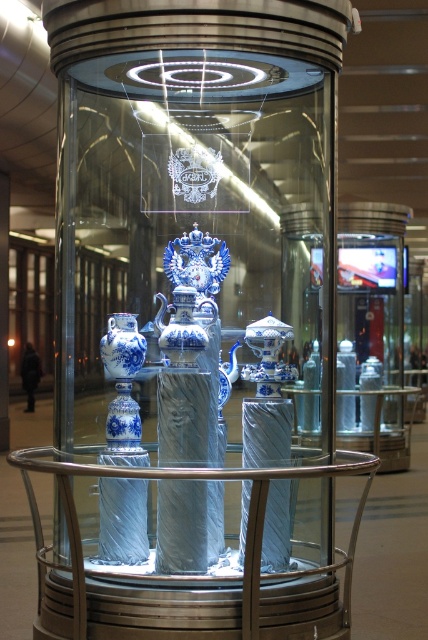
Question: Among these points, which one is farthest from the camera?

Choices:
 (A) (190, 321)
 (B) (133, 371)

Answer: (B)

Question: Can you confirm if clear glass table at center is positioned to the left of blue porcelain teapot at center?

Choices:
 (A) no
 (B) yes

Answer: (A)

Question: Among these points, which one is nearest to the camera?

Choices:
 (A) (124, 332)
 (B) (178, 304)
 (C) (109, 470)

Answer: (C)

Question: Among these points, which one is farthest from the camera?

Choices:
 (A) (183, 317)
 (B) (142, 476)
 (C) (127, 364)

Answer: (C)

Question: Does clear glass table at center have a greater width compared to blue porcelain teapot at center?

Choices:
 (A) yes
 (B) no

Answer: (A)

Question: Does blue porcelain teapot at center appear on the right side of blue porcelain vase at center?

Choices:
 (A) no
 (B) yes

Answer: (B)